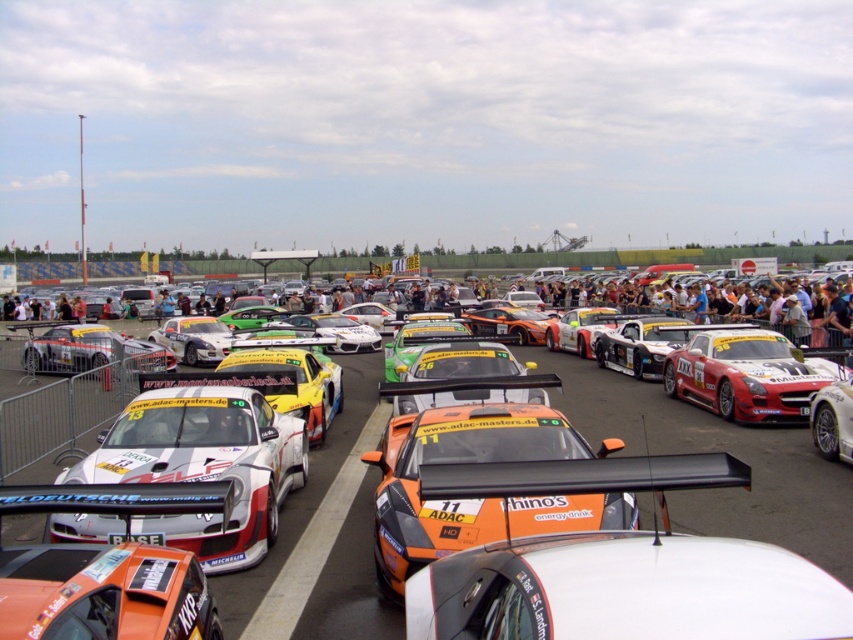
In the scene shown: Between orange matte race car at center and orange glossy race car at center, which one is positioned higher?

orange matte race car at center is higher up.

Measure the distance between orange matte race car at center and orange glossy race car at center.

They are 8.53 feet apart.

Is point (614, 570) behind point (567, 516)?

No, (614, 570) is closer to viewer.

The width and height of the screenshot is (853, 640). I want to click on orange matte race car at center, so click(616, 564).

Who is more distant from viewer, (647, 618) or (300, 625)?

Positioned behind is point (300, 625).

Which is in front, point (587, 460) or point (276, 560)?

Positioned in front is point (587, 460).

Find the location of a particular element. The width and height of the screenshot is (853, 640). orange matte race car at center is located at coordinates (616, 564).

Does orange glossy car at center appear over white glossy race car at center?

Yes, orange glossy car at center is above white glossy race car at center.

Is orange glossy car at center closer to the viewer compared to white glossy race car at center?

Yes.

What do you see at coordinates (717, 449) in the screenshot? I see `orange glossy car at center` at bounding box center [717, 449].

I want to click on orange glossy car at center, so click(x=717, y=449).